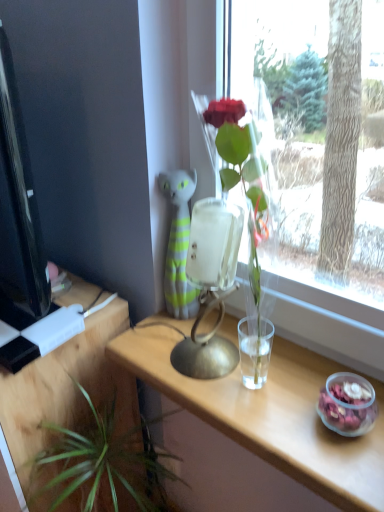
The image size is (384, 512). What are the coordinates of `blank space situated above clear wood table at center, the 1th table from the right (from a real-world perspective)` in the screenshot? It's located at (252, 390).